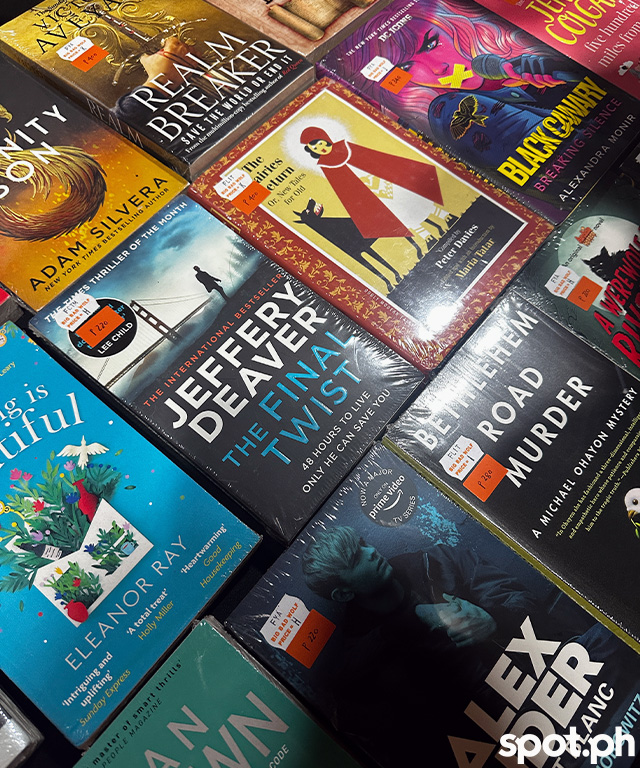
Find the location of `book`. book is located at coordinates (188, 518).